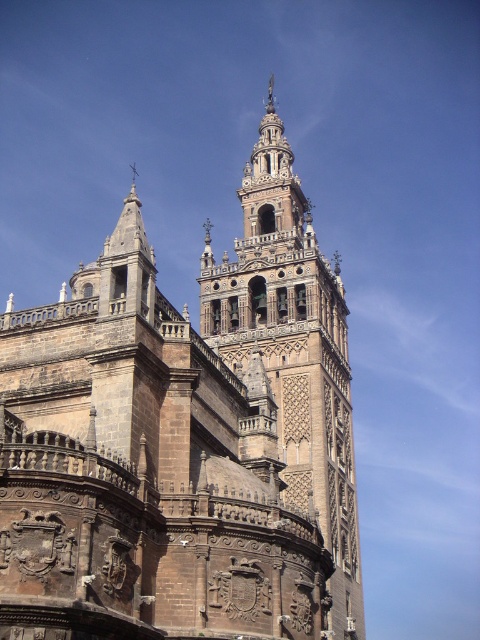
Can you confirm if brown stone church at center is positioned below brown stone tower at center?

Correct, brown stone church at center is located below brown stone tower at center.

Where is `brown stone church at center`? brown stone church at center is located at coordinates (184, 438).